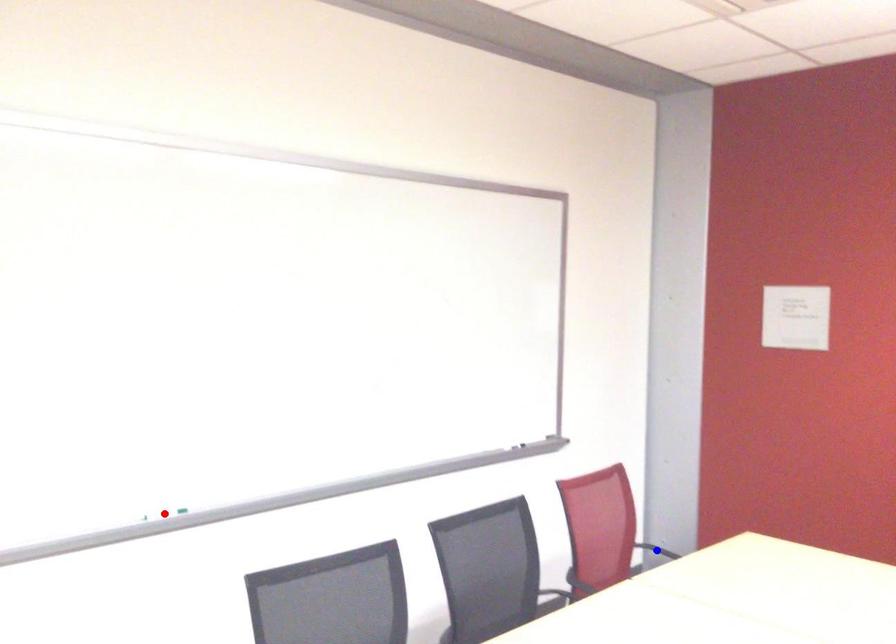
Question: Which of the two points in the image is closer to the camera?

Choices:
 (A) Blue point is closer.
 (B) Red point is closer.

Answer: (B)